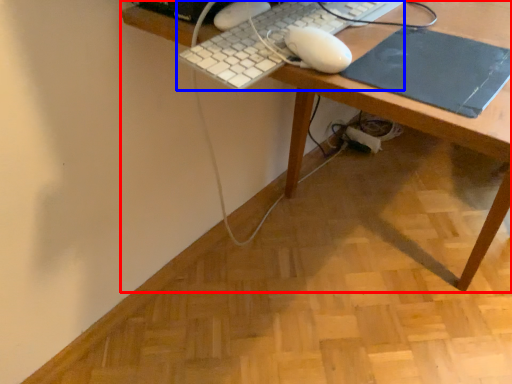
Question: Which point is closer to the camera, desk (highlighted by a red box) or computer keyboard (highlighted by a blue box)?

Choices:
 (A) desk
 (B) computer keyboard

Answer: (A)